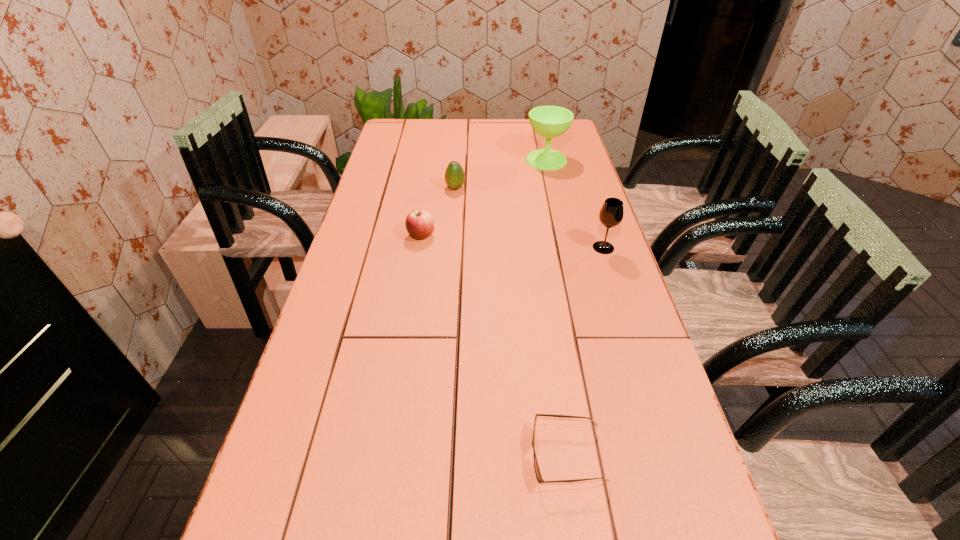
Where is `object that is the third closest to the nearest object`? object that is the third closest to the nearest object is located at coordinates (454, 175).

Where is `the third closest object to the sunglasses`? the third closest object to the sunglasses is located at coordinates (454, 175).

The height and width of the screenshot is (540, 960). Find the location of `vacant region that satisfies the following two spatial constraints: 1. on the front side of the farther wineglass; 2. on the left side of the nearer wineglass`. vacant region that satisfies the following two spatial constraints: 1. on the front side of the farther wineglass; 2. on the left side of the nearer wineglass is located at coordinates (565, 247).

Locate an element on the screen. free point that satisfies the following two spatial constraints: 1. on the front side of the nearer wineglass; 2. on the lenses of the sunglasses is located at coordinates (670, 455).

At what (x,y) coordinates should I click in order to perform the action: click on vacant area in the image that satisfies the following two spatial constraints: 1. on the back side of the farther wineglass; 2. on the right side of the fourth tallest object. Please return your answer as a coordinate pair (x, y). This screenshot has height=540, width=960. Looking at the image, I should click on (433, 160).